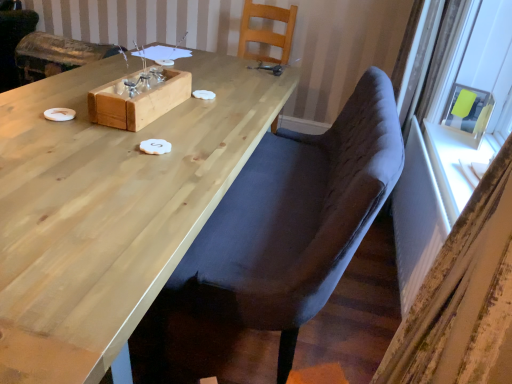
The width and height of the screenshot is (512, 384). Identify the location of empty space that is to the right of wooden box at center. (212, 120).